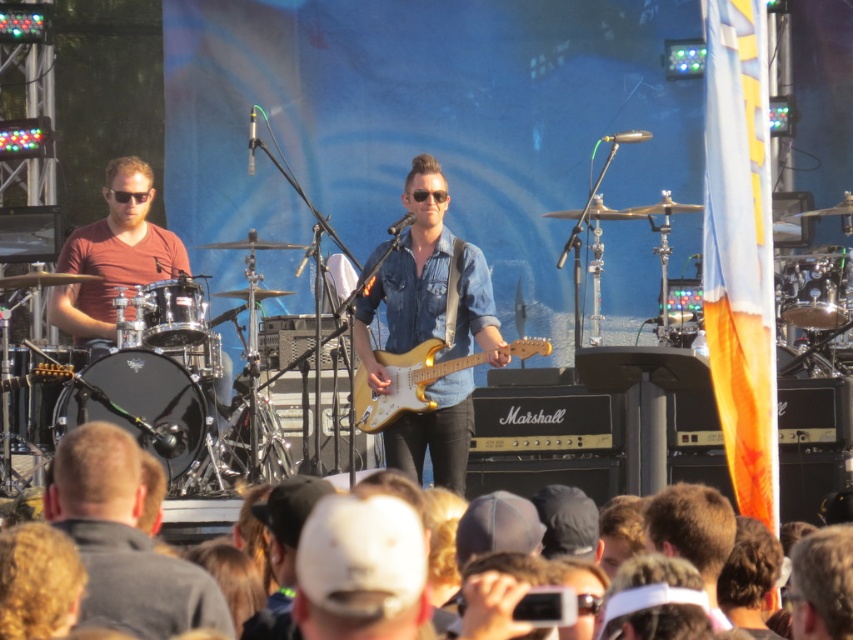
You are a photographer standing at the back of the crowd. You want to take a photo of the denim shirt at center. Where should you aim your camera?

You should aim your camera at point (x=408, y=275) to capture the denim shirt at center.

You are a stagehand who needs to transport both the shiny black drum at left and the shiny black drum at center right. If your truck has a loading space that can only accommodate items up to the width of the narrower drum, which drum should you load first to ensure both can fit?

You should load the shiny black drum at center right first since it is narrower than the shiny black drum at left. This way, both drums can fit within the truck space as the narrower one will occupy less width, allowing the wider drum to be placed alongside or after without exceeding the limit.